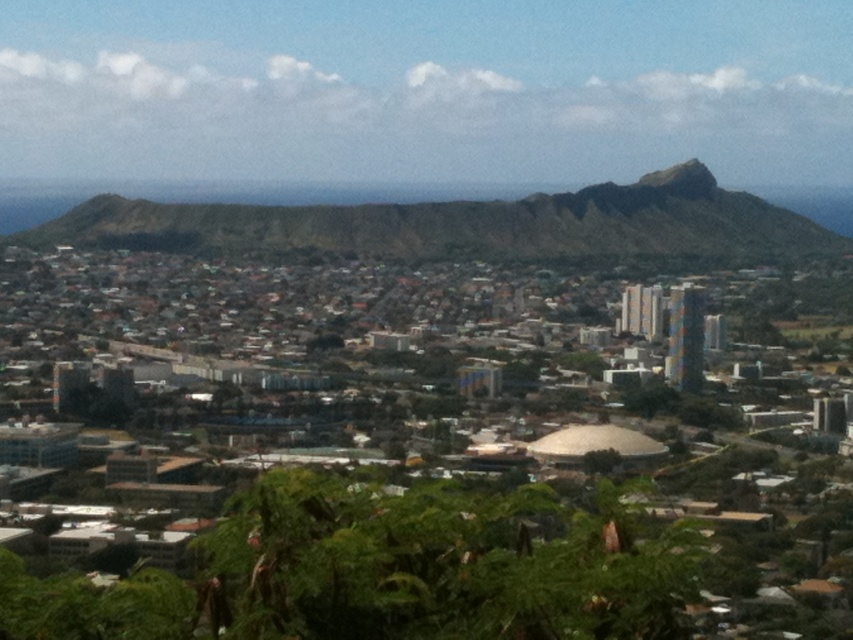
Question: Which of the following is the closest to the observer?

Choices:
 (A) (682, 168)
 (B) (422, 214)

Answer: (B)

Question: Can you confirm if brown rocky mountain at center is bigger than green mossy rock at upper center?

Choices:
 (A) yes
 (B) no

Answer: (A)

Question: Is brown rocky mountain at center positioned at the back of green mossy rock at upper center?

Choices:
 (A) no
 (B) yes

Answer: (A)

Question: Among these points, which one is nearest to the camera?

Choices:
 (A) (306, 224)
 (B) (668, 172)

Answer: (A)

Question: Does brown rocky mountain at center have a smaller size compared to green mossy rock at upper center?

Choices:
 (A) yes
 (B) no

Answer: (B)

Question: Which point appears closest to the camera in this image?

Choices:
 (A) (387, 209)
 (B) (712, 192)

Answer: (A)